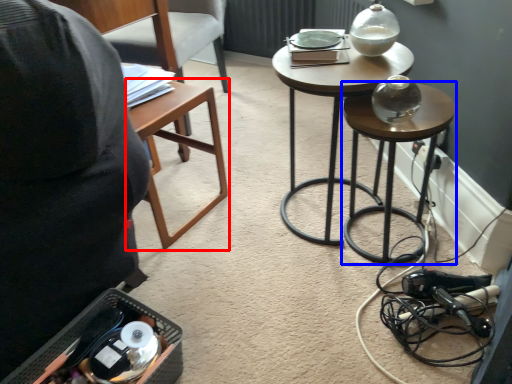
Question: Which point is further to the camera, table (highlighted by a red box) or stool (highlighted by a blue box)?

Choices:
 (A) table
 (B) stool

Answer: (A)